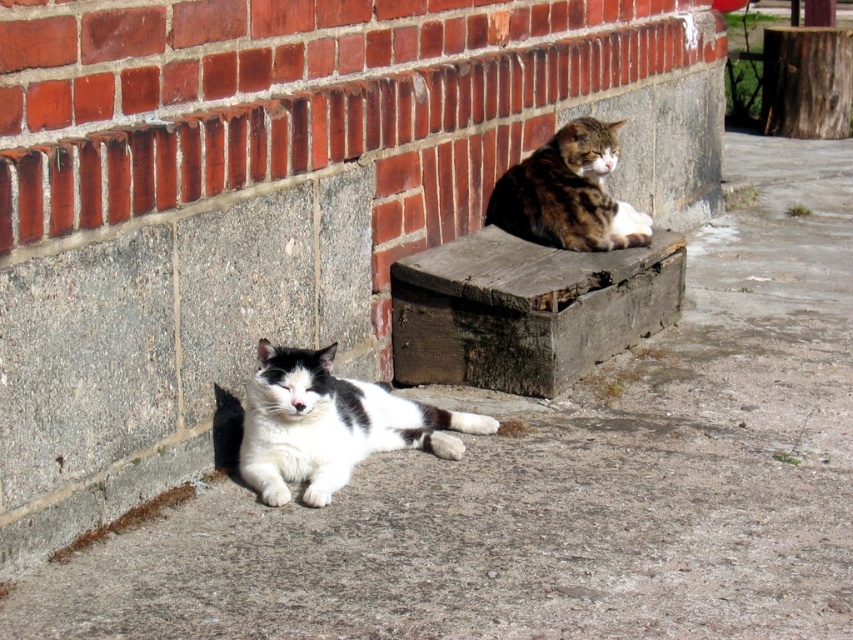
Question: Is white soft fur cat at lower left wider than tabby fur cat at upper center?

Choices:
 (A) yes
 (B) no

Answer: (A)

Question: Which of the following is the farthest from the observer?

Choices:
 (A) white soft fur cat at lower left
 (B) tabby fur cat at upper center
 (C) weathered wood bench at upper center

Answer: (B)

Question: Which point is closer to the camera taking this photo?

Choices:
 (A) (508, 221)
 (B) (461, 289)
 (C) (485, 428)

Answer: (C)

Question: Does weathered wood bench at upper center have a greater width compared to white soft fur cat at lower left?

Choices:
 (A) no
 (B) yes

Answer: (B)

Question: Can you confirm if weathered wood bench at upper center is positioned above white soft fur cat at lower left?

Choices:
 (A) yes
 (B) no

Answer: (A)

Question: Which object appears closest to the camera in this image?

Choices:
 (A) weathered wood bench at upper center
 (B) tabby fur cat at upper center
 (C) white soft fur cat at lower left

Answer: (C)